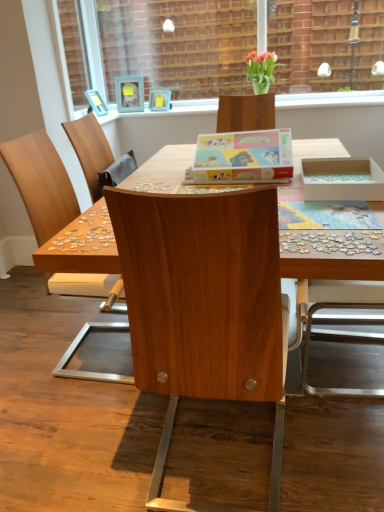
You are a GUI agent. You are given a task and a screenshot of the screen. Output one action in this format:
    pyautogui.click(x=<x>, y=<y>)
    Task: Click on the vacant area situated to the left side of wooden chair at center
    This screenshot has height=512, width=384.
    Given the screenshot: What is the action you would take?
    pyautogui.click(x=36, y=357)